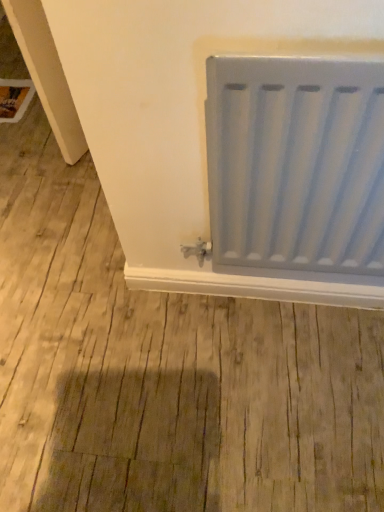
What do you see at coordinates (257, 287) in the screenshot? I see `white matte window sill at lower center` at bounding box center [257, 287].

Where is `white matte window sill at lower center`? This screenshot has width=384, height=512. white matte window sill at lower center is located at coordinates (257, 287).

Find the location of a particular element. The image size is (384, 512). satin white radiator at right is located at coordinates (296, 163).

The image size is (384, 512). Describe the element at coordinates (296, 163) in the screenshot. I see `satin white radiator at right` at that location.

Where is `white matte window sill at lower center`? white matte window sill at lower center is located at coordinates pos(257,287).

Which object is positioned more to the right, white matte window sill at lower center or satin white radiator at right?

From the viewer's perspective, satin white radiator at right appears more on the right side.

Which is behind, white matte window sill at lower center or satin white radiator at right?

Positioned behind is white matte window sill at lower center.

Is point (195, 277) positioned before point (278, 57)?

No, (195, 277) is behind (278, 57).

From the image's perspective, is white matte window sill at lower center below satin white radiator at right?

Correct, white matte window sill at lower center appears lower than satin white radiator at right in the image.

From a real-world perspective, between white matte window sill at lower center and satin white radiator at right, who is vertically higher?

satin white radiator at right is physically above.

Does white matte window sill at lower center have a greater width compared to satin white radiator at right?

Incorrect, the width of white matte window sill at lower center does not surpass that of satin white radiator at right.

Can you confirm if white matte window sill at lower center is taller than satin white radiator at right?

In fact, white matte window sill at lower center may be shorter than satin white radiator at right.

In the scene shown: Can you confirm if white matte window sill at lower center is smaller than satin white radiator at right?

Yes, white matte window sill at lower center is smaller than satin white radiator at right.

Is satin white radiator at right a part of white matte window sill at lower center?

No, satin white radiator at right is not surrounded by white matte window sill at lower center.

Is there a large distance between white matte window sill at lower center and satin white radiator at right?

Actually, white matte window sill at lower center and satin white radiator at right are a little close together.

Does white matte window sill at lower center turn towards satin white radiator at right?

No, white matte window sill at lower center is not turned towards satin white radiator at right.

Can you tell me how much white matte window sill at lower center and satin white radiator at right differ in facing direction?

0.00234 degrees separate the facing orientations of white matte window sill at lower center and satin white radiator at right.

How far apart are white matte window sill at lower center and satin white radiator at right?

white matte window sill at lower center is 15.18 inches away from satin white radiator at right.

Where is `radiator above the white matte window sill at lower center (from the image's perspective)`? radiator above the white matte window sill at lower center (from the image's perspective) is located at coordinates (296, 163).

In the scene shown: Between satin white radiator at right and white matte window sill at lower center, which one appears on the left side from the viewer's perspective?

Positioned to the left is white matte window sill at lower center.

Is the position of satin white radiator at right more distant than that of white matte window sill at lower center?

No, satin white radiator at right is in front of white matte window sill at lower center.

Does point (299, 194) lie in front of point (138, 285)?

Yes, point (299, 194) is closer to viewer.

From the image's perspective, which is below, satin white radiator at right or white matte window sill at lower center?

white matte window sill at lower center, from the image's perspective.

From a real-world perspective, relative to white matte window sill at lower center, is satin white radiator at right vertically above or below?

From a real-world perspective, satin white radiator at right is physically above white matte window sill at lower center.

In the scene shown: Between satin white radiator at right and white matte window sill at lower center, which one has larger width?

satin white radiator at right.

Considering the sizes of objects satin white radiator at right and white matte window sill at lower center in the image provided, who is shorter, satin white radiator at right or white matte window sill at lower center?

white matte window sill at lower center.

Looking at the image, does satin white radiator at right seem bigger or smaller compared to white matte window sill at lower center?

Clearly, satin white radiator at right is larger in size than white matte window sill at lower center.

Would you say satin white radiator at right is outside white matte window sill at lower center?

Yes, satin white radiator at right is not within white matte window sill at lower center.

Are satin white radiator at right and white matte window sill at lower center far apart?

No, satin white radiator at right is not far from white matte window sill at lower center.

Is satin white radiator at right looking in the opposite direction of white matte window sill at lower center?

No, satin white radiator at right is not facing the opposite direction of white matte window sill at lower center.

How different are the orientations of satin white radiator at right and white matte window sill at lower center in degrees?

The angular difference between satin white radiator at right and white matte window sill at lower center is 0.00234 degrees.

Where is `window sill below the satin white radiator at right (from the image's perspective)`? Image resolution: width=384 pixels, height=512 pixels. window sill below the satin white radiator at right (from the image's perspective) is located at coordinates (257, 287).

What are the coordinates of `radiator that is above the white matte window sill at lower center (from the image's perspective)` in the screenshot? It's located at (296, 163).

There is a white matte window sill at lower center. Where is `radiator above it (from a real-world perspective)`? radiator above it (from a real-world perspective) is located at coordinates point(296,163).